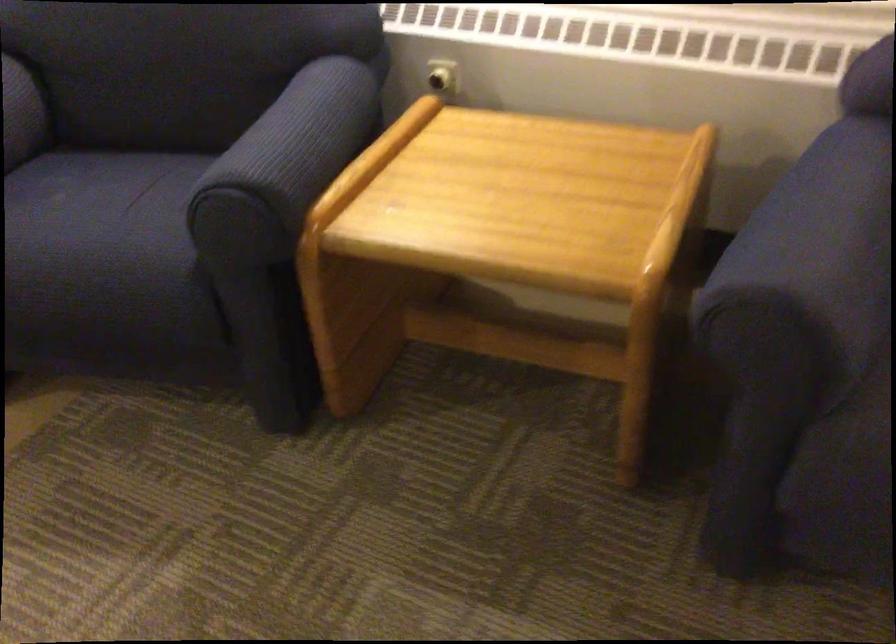
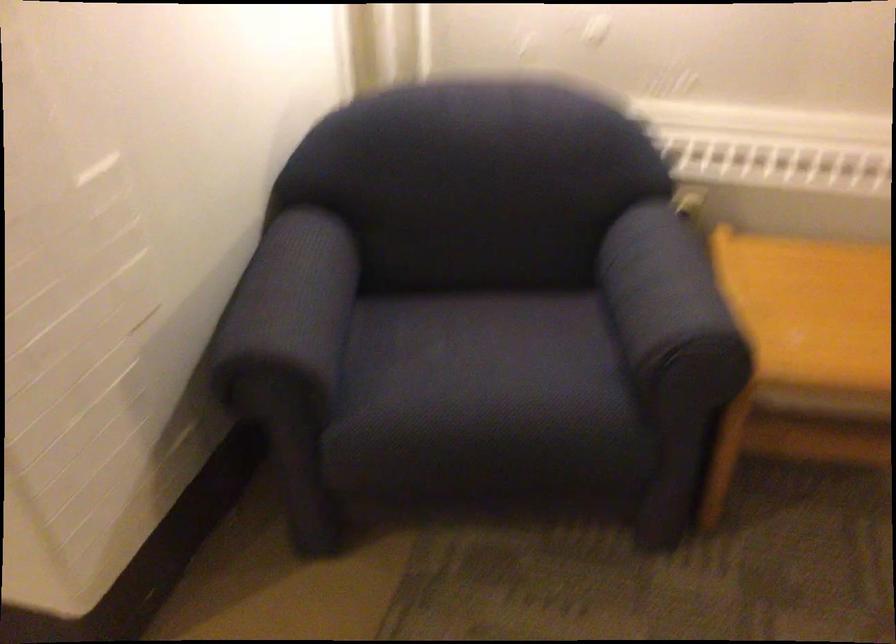
Locate, in the second image, the point that corresponds to [238,164] in the first image.

(670, 307)